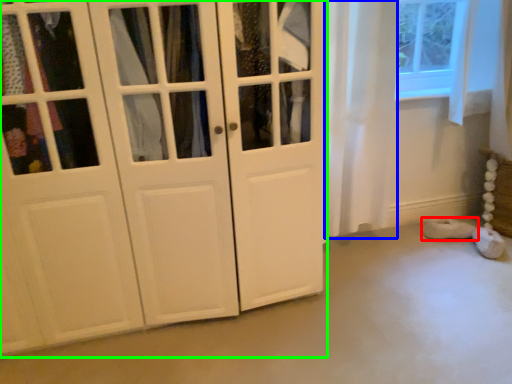
Question: Which is nearer to the footwear (highlighted by a red box)? curtain (highlighted by a blue box) or cupboard (highlighted by a green box).

Choices:
 (A) curtain
 (B) cupboard

Answer: (A)